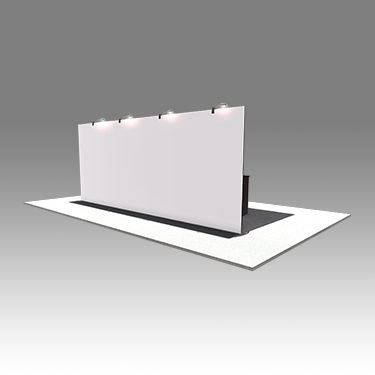
Locate an element on the screen. This screenshot has height=375, width=375. white floor is located at coordinates [240, 254].